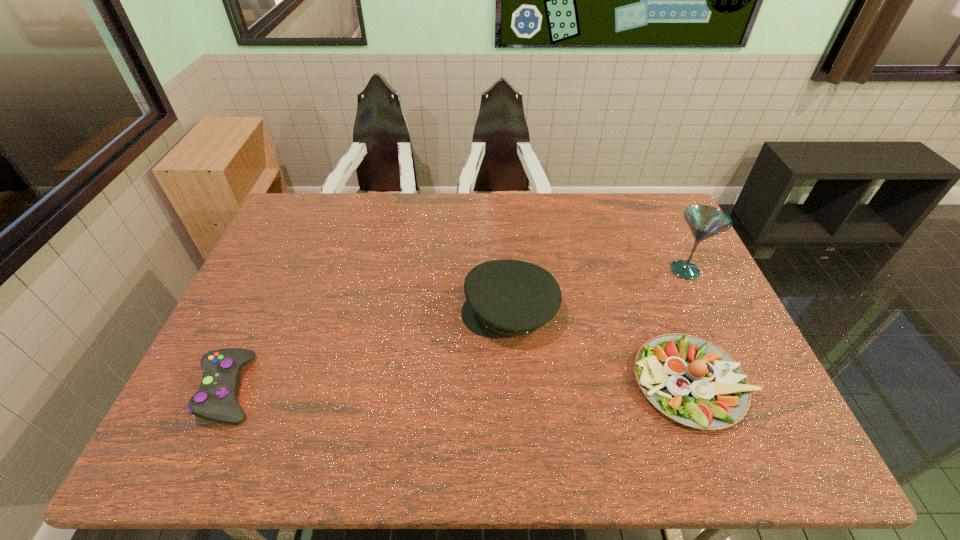
I want to click on vacant space at the left edge, so click(229, 318).

The height and width of the screenshot is (540, 960). What are the coordinates of `free space at the right edge` in the screenshot? It's located at (664, 236).

Locate an element on the screen. Image resolution: width=960 pixels, height=540 pixels. vacant space at the far left corner of the desktop is located at coordinates (329, 201).

Identify the location of vacant area at the near left corner of the desktop. (167, 449).

Where is `empty location between the salad plate and the shortest object`? This screenshot has width=960, height=540. empty location between the salad plate and the shortest object is located at coordinates (461, 386).

At what (x,y) coordinates should I click in order to perform the action: click on free space between the second tallest object and the martini. Please return your answer as a coordinate pair (x, y). The height and width of the screenshot is (540, 960). Looking at the image, I should click on (597, 291).

At what (x,y) coordinates should I click in order to perform the action: click on unoccupied position between the beret and the control. Please return your answer as a coordinate pair (x, y). Looking at the image, I should click on (370, 350).

What are the coordinates of `free space between the third object from right to left and the martini` in the screenshot? It's located at (597, 291).

I want to click on empty space between the martini and the salad plate, so click(688, 327).

Identify the location of empty location between the third object from right to left and the martini. Image resolution: width=960 pixels, height=540 pixels. (597, 291).